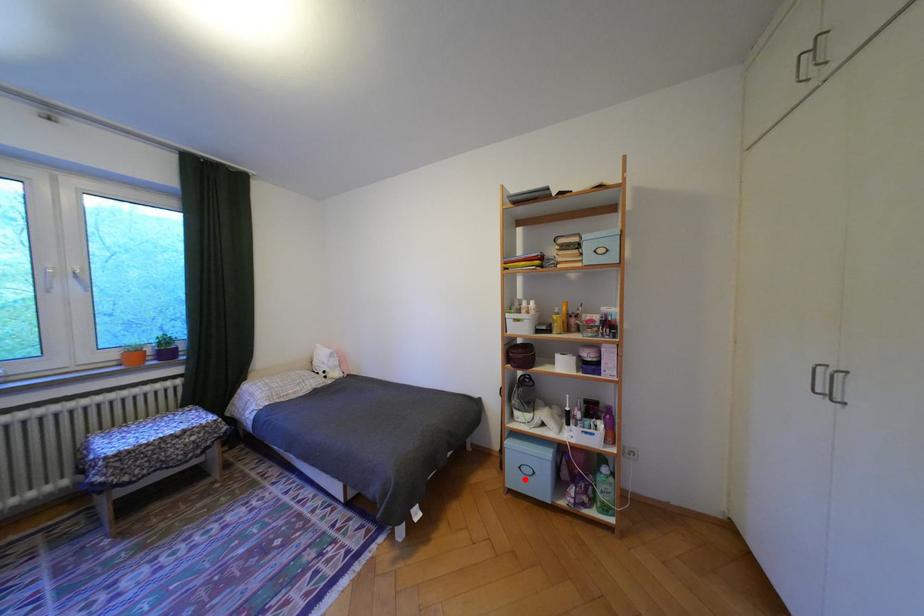
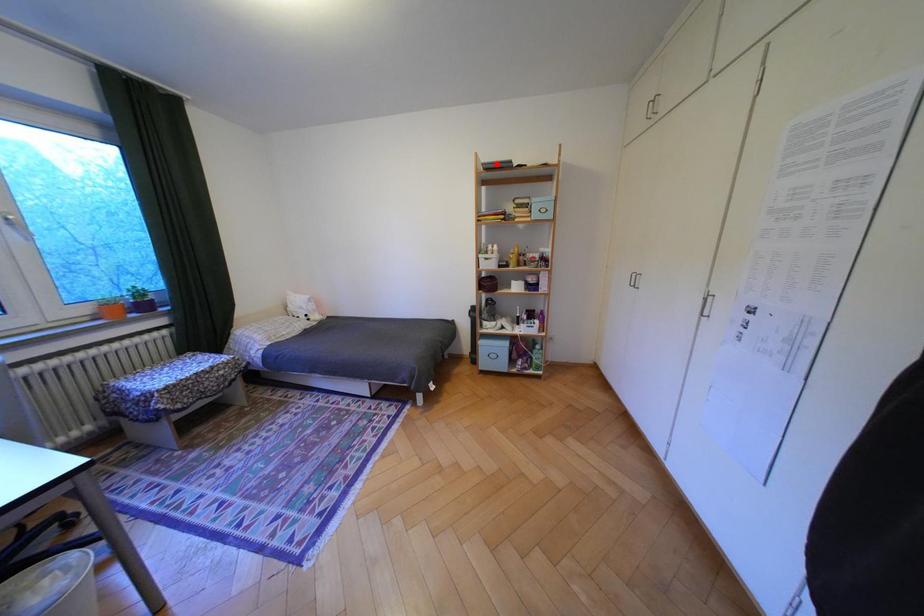
I am providing you with two images of the same scene from different viewpoints. A red point is marked on the first image and another point is marked on the second image. Are the points marked in image1 and image2 representing the same 3D position?

No